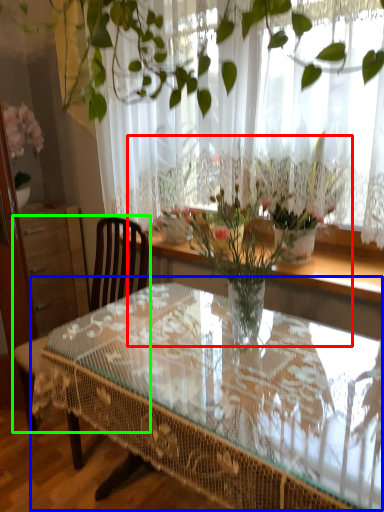
Question: Considering the real-world distances, which object is closest to floral arrangement (highlighted by a red box)? coffee table (highlighted by a blue box) or chair (highlighted by a green box).

Choices:
 (A) coffee table
 (B) chair

Answer: (A)